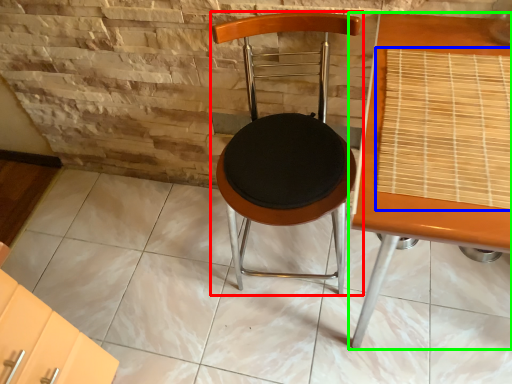
Question: Which object is positioned farthest from chair (highlighted by a red box)? Select from mat (highlighted by a blue box) and table (highlighted by a green box).

Choices:
 (A) mat
 (B) table

Answer: (A)